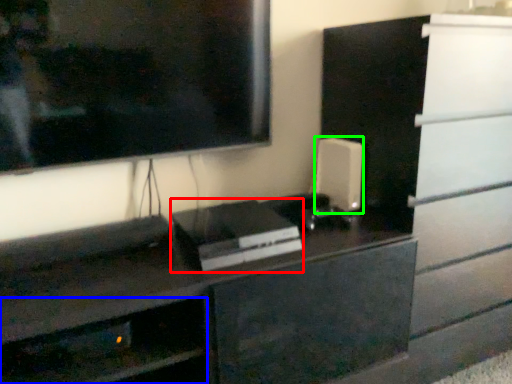
Question: Which object is the closest to the appliance (highlighted by a red box)? Choose among these: shelf (highlighted by a blue box) or appliance (highlighted by a green box).

Choices:
 (A) shelf
 (B) appliance

Answer: (B)